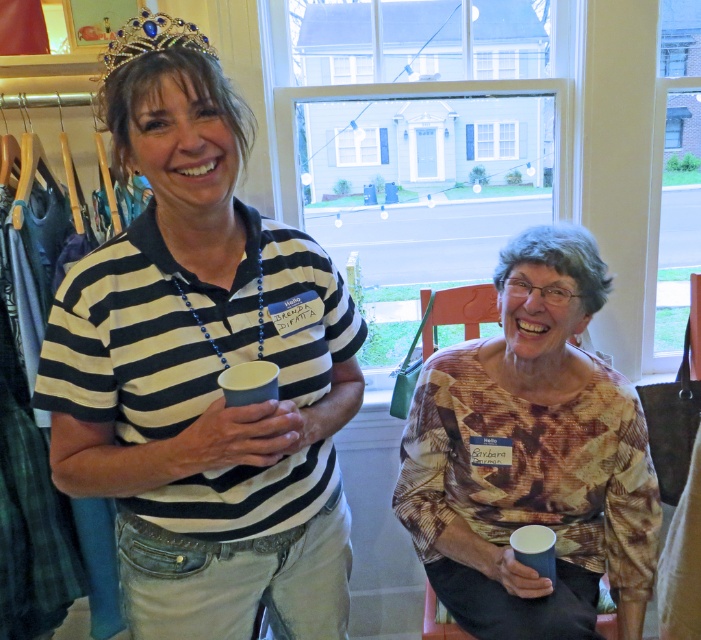
You are a photographer at the event and want to ensure both the printed fabric blouse at center and the gold beaded crown at upper center are clearly visible in the photo. Based on their sizes, which one might require more careful framing to avoid being cut off?

The printed fabric blouse at center is much taller than the gold beaded crown at upper center, so it might require more careful framing to avoid being cut off due to its larger size.

You are at a social event and want to take a photo of the two points in the image. The first point is at coordinates point (142, 465) and the second is at point (611, 486). Which point is closer to you?

Point (142, 465) is closer to the viewer than point (611, 486).

You are organizing a costume party and need to ensure that all accessories fit within the designated display area. The display area can only accommodate items up to the width of the gold beaded crown at upper center. You have the striped cotton shirt at center to place there. Will it fit?

The striped cotton shirt at center is wider than the gold beaded crown at upper center, so it will not fit within the display area designed for items up to the crown width.